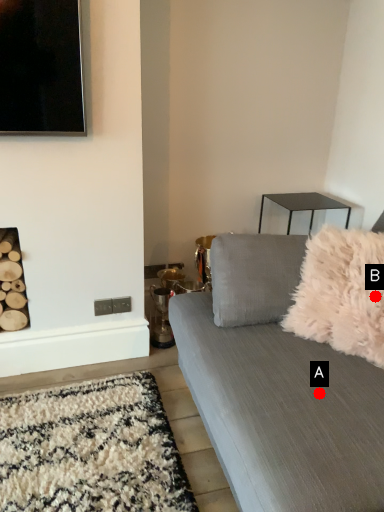
Question: Two points are circled on the image, labeled by A and B beside each circle. Among these points, which one is farthest from the camera?

Choices:
 (A) A is further
 (B) B is further

Answer: (B)